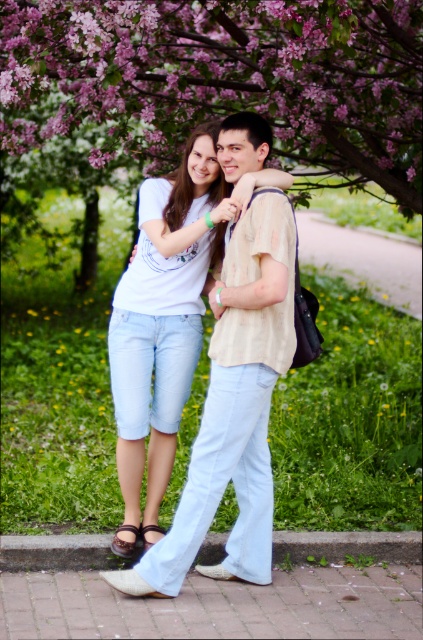
Question: Among these objects, which one is nearest to the camera?

Choices:
 (A) light blue denim shorts at center
 (B) pink blossoms at upper center
 (C) brick pavement at lower center

Answer: (C)

Question: Which point is closer to the camera?

Choices:
 (A) brick pavement at lower center
 (B) light blue denim shorts at center
 (C) pink blossoms at upper center

Answer: (A)

Question: Does pink blossoms at upper center lie behind brick pavement at lower center?

Choices:
 (A) yes
 (B) no

Answer: (A)

Question: Does pink blossoms at upper center have a larger size compared to brick pavement at lower center?

Choices:
 (A) yes
 (B) no

Answer: (A)

Question: Is light blue denim shorts at center to the left of brick pavement at lower center from the viewer's perspective?

Choices:
 (A) no
 (B) yes

Answer: (A)

Question: Which point is farther to the camera?

Choices:
 (A) [x=353, y=97]
 (B) [x=253, y=256]

Answer: (A)